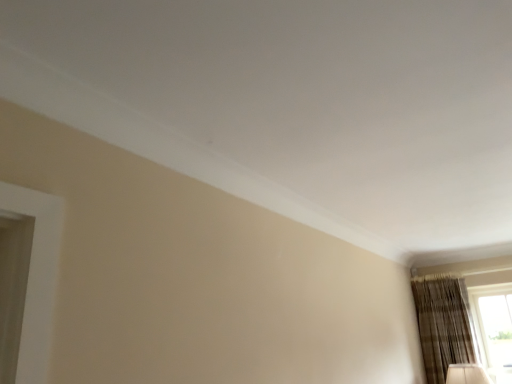
Question: Is brown textured curtain at lower right further to the viewer compared to transparent glass window at lower right?

Choices:
 (A) yes
 (B) no

Answer: (B)

Question: Does brown textured curtain at lower right have a greater width compared to transparent glass window at lower right?

Choices:
 (A) yes
 (B) no

Answer: (A)

Question: Does brown textured curtain at lower right turn towards transparent glass window at lower right?

Choices:
 (A) no
 (B) yes

Answer: (A)

Question: Is brown textured curtain at lower right bigger than transparent glass window at lower right?

Choices:
 (A) no
 (B) yes

Answer: (B)

Question: From a real-world perspective, is brown textured curtain at lower right on top of transparent glass window at lower right?

Choices:
 (A) no
 (B) yes

Answer: (B)

Question: Is brown textured curtain at lower right not within transparent glass window at lower right?

Choices:
 (A) no
 (B) yes

Answer: (B)

Question: Is transparent glass window at lower right smaller than brown textured curtain at lower right?

Choices:
 (A) yes
 (B) no

Answer: (A)

Question: Does transparent glass window at lower right lie in front of brown textured curtain at lower right?

Choices:
 (A) no
 (B) yes

Answer: (A)

Question: Is transparent glass window at lower right positioned with its back to brown textured curtain at lower right?

Choices:
 (A) yes
 (B) no

Answer: (B)

Question: From the image's perspective, is transparent glass window at lower right located beneath brown textured curtain at lower right?

Choices:
 (A) no
 (B) yes

Answer: (B)

Question: Considering the relative sizes of transparent glass window at lower right and brown textured curtain at lower right in the image provided, is transparent glass window at lower right wider than brown textured curtain at lower right?

Choices:
 (A) no
 (B) yes

Answer: (A)

Question: Is transparent glass window at lower right aimed at brown textured curtain at lower right?

Choices:
 (A) no
 (B) yes

Answer: (A)

Question: Is transparent glass window at lower right bigger or smaller than brown textured curtain at lower right?

Choices:
 (A) small
 (B) big

Answer: (A)